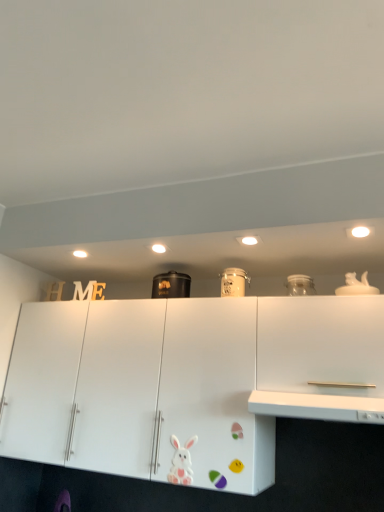
Question: In which direction should I rotate to look at black matte container at center, which is the 1th appliance in left-to-right order?

Choices:
 (A) right
 (B) left

Answer: (B)

Question: Is white matte rabbit at lower center positioned before black matte container at center, which is the second appliance in right-to-left order?

Choices:
 (A) no
 (B) yes

Answer: (B)

Question: Is white matte rabbit at lower center facing away from black matte container at center, which is the 1th appliance in left-to-right order?

Choices:
 (A) yes
 (B) no

Answer: (B)

Question: From a real-world perspective, is white matte rabbit at lower center located beneath black matte container at center, acting as the 2th appliance starting from the front?

Choices:
 (A) yes
 (B) no

Answer: (A)

Question: Does white matte rabbit at lower center appear on the right side of black matte container at center, acting as the 2th appliance starting from the front?

Choices:
 (A) no
 (B) yes

Answer: (B)

Question: Would you consider white matte rabbit at lower center to be distant from black matte container at center, which is the 1th appliance in left-to-right order?

Choices:
 (A) yes
 (B) no

Answer: (B)

Question: Is white matte rabbit at lower center oriented towards black matte container at center, which is the 1th appliance in left-to-right order?

Choices:
 (A) yes
 (B) no

Answer: (B)

Question: Would you say white matte cabinet at right is outside white glossy counter top at center?

Choices:
 (A) yes
 (B) no

Answer: (A)

Question: From a real-world perspective, is white matte cabinet at right positioned over white glossy counter top at center based on gravity?

Choices:
 (A) no
 (B) yes

Answer: (B)

Question: Is white matte cabinet at right behind white glossy counter top at center?

Choices:
 (A) no
 (B) yes

Answer: (B)

Question: Is white matte cabinet at right looking in the opposite direction of white glossy counter top at center?

Choices:
 (A) no
 (B) yes

Answer: (A)

Question: Is white matte cabinet at right aimed at white glossy counter top at center?

Choices:
 (A) yes
 (B) no

Answer: (A)

Question: Is white matte cabinet at right shorter than white glossy counter top at center?

Choices:
 (A) no
 (B) yes

Answer: (A)

Question: Is white matte rabbit at lower center at the left side of white matte cabinet at right?

Choices:
 (A) no
 (B) yes

Answer: (B)